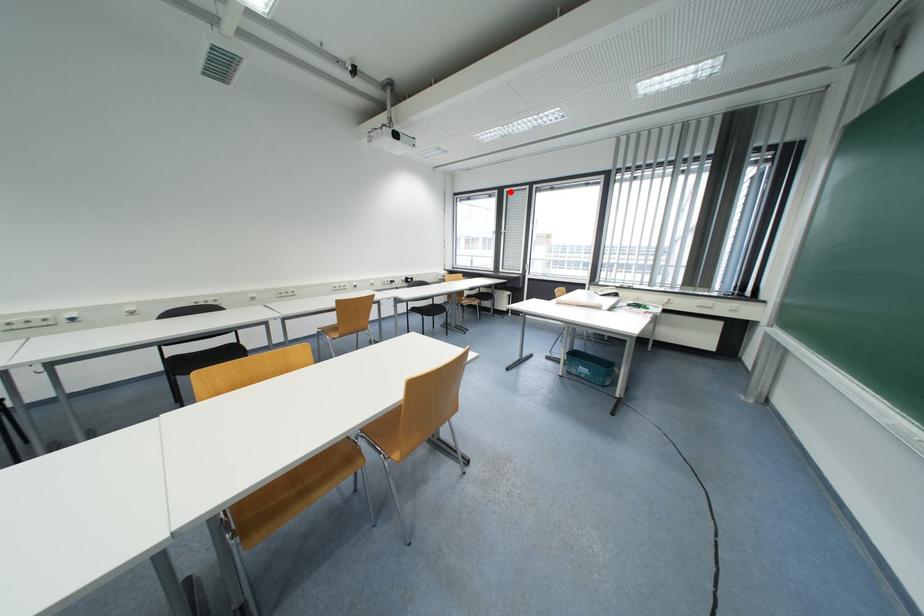
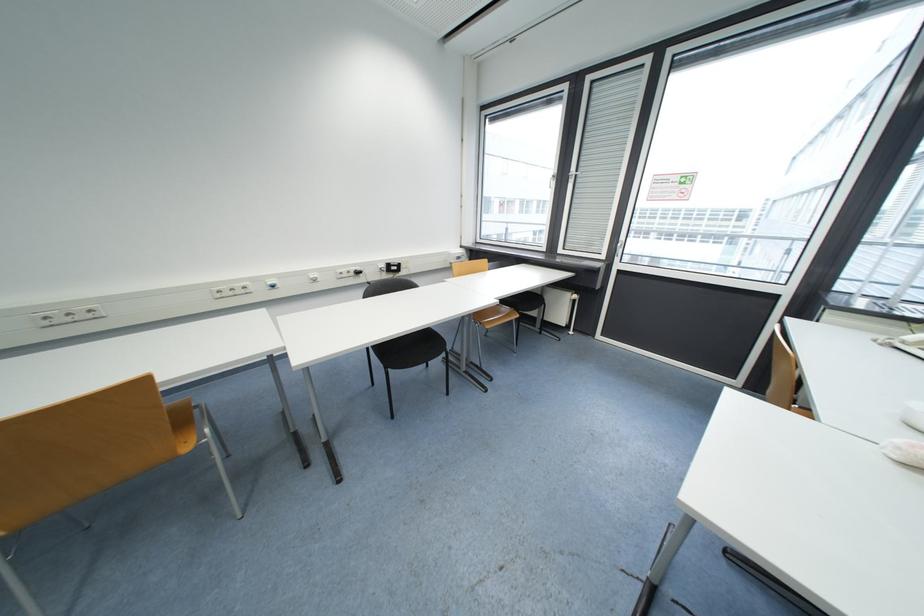
Locate, in the second image, the point that corresponds to the highlighted location in the first image.

(593, 81)